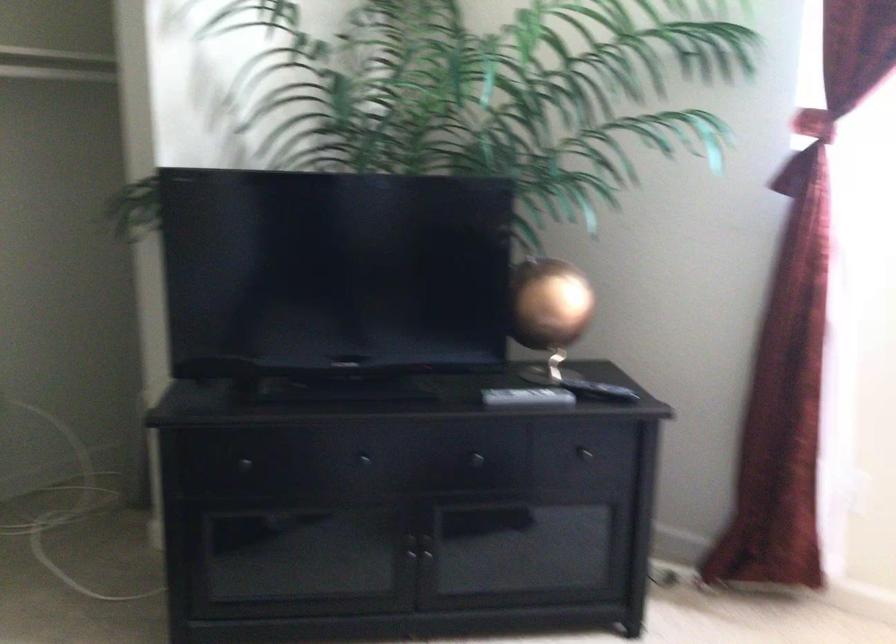
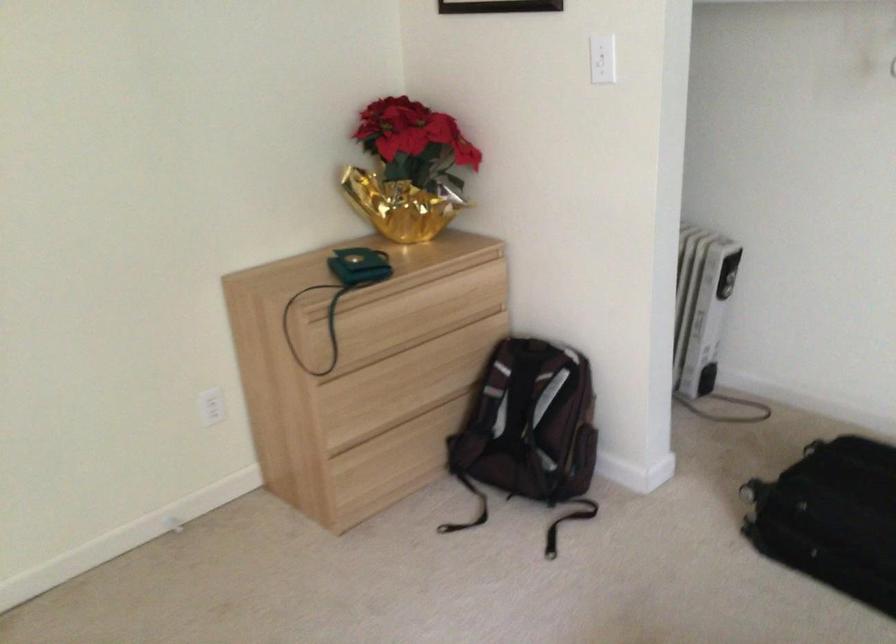
The images are taken continuously from a first-person perspective. In which direction is your viewpoint rotating?

The camera's rotation is toward left-down.